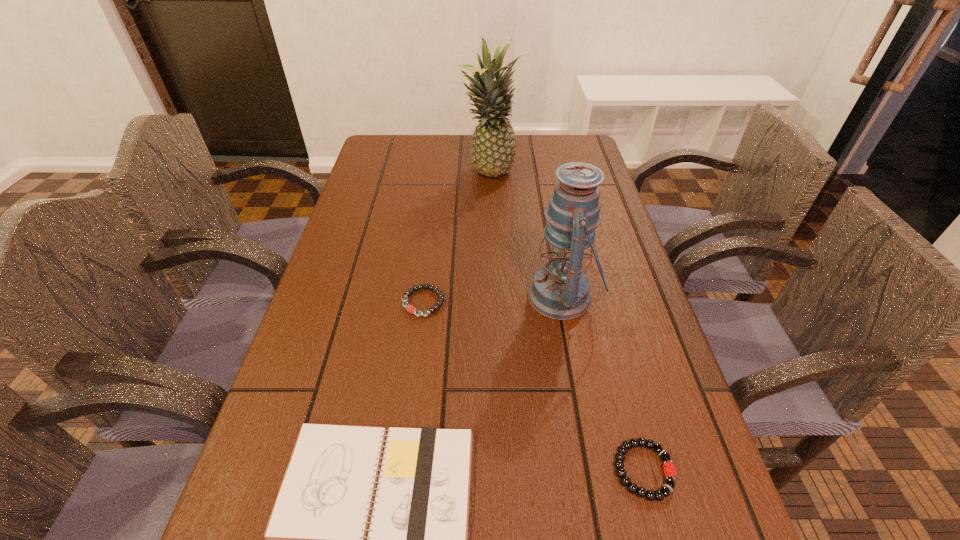
This screenshot has width=960, height=540. What are the coordinates of `free space between the nearer bracelet and the pineapple` in the screenshot? It's located at (565, 322).

Image resolution: width=960 pixels, height=540 pixels. What are the coordinates of `free space between the pineapple and the left bracelet` in the screenshot? It's located at (455, 238).

At what (x,y) coordinates should I click in order to perform the action: click on free point between the farthest object and the left bracelet. Please return your answer as a coordinate pair (x, y). The image size is (960, 540). Looking at the image, I should click on (455, 238).

Where is `the third closest object to the pineapple`? The height and width of the screenshot is (540, 960). the third closest object to the pineapple is located at coordinates (417, 539).

Find the location of a particular element. Image resolution: width=960 pixels, height=540 pixels. object that is the third closest to the notepad is located at coordinates (411, 309).

Identify the location of free location that satisfies the following two spatial constraints: 1. on the front-facing side of the fourth shortest object; 2. on the front side of the farther bracelet. [x=564, y=302].

Image resolution: width=960 pixels, height=540 pixels. In order to click on free space that satisfies the following two spatial constraints: 1. on the front-facing side of the nearer bracelet; 2. on the right side of the lantern in this screenshot , I will do `click(594, 470)`.